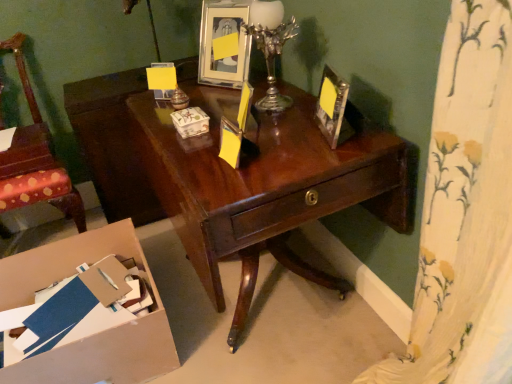
Locate an element on the screen. This screenshot has height=384, width=512. unoccupied region to the right of matte ceramic box at center is located at coordinates (232, 118).